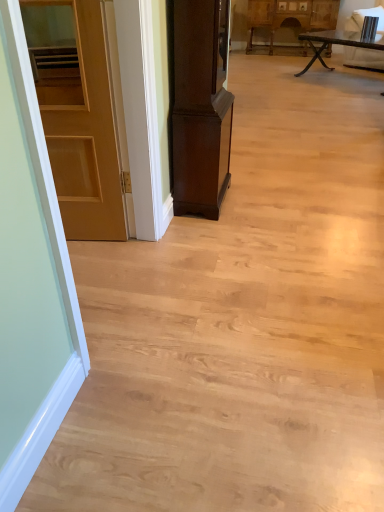
I want to click on free location in front of matte wooden door at left, so click(89, 261).